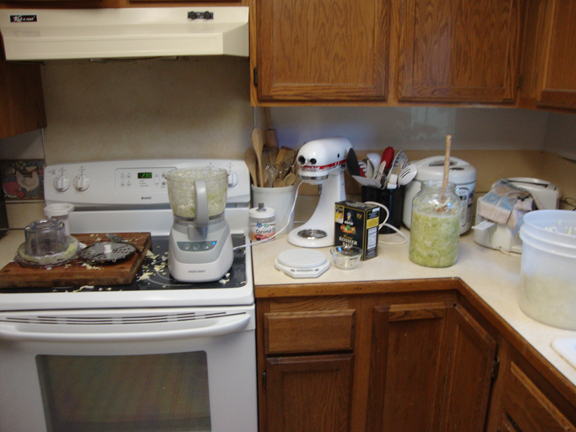
You are a GUI agent. You are given a task and a screenshot of the screen. Output one action in this format:
    pyautogui.click(x=<x>, y=<y>)
    Task: Click on the glass bowl
    The width and height of the screenshot is (576, 432).
    Given the screenshot: What is the action you would take?
    pyautogui.click(x=344, y=259)